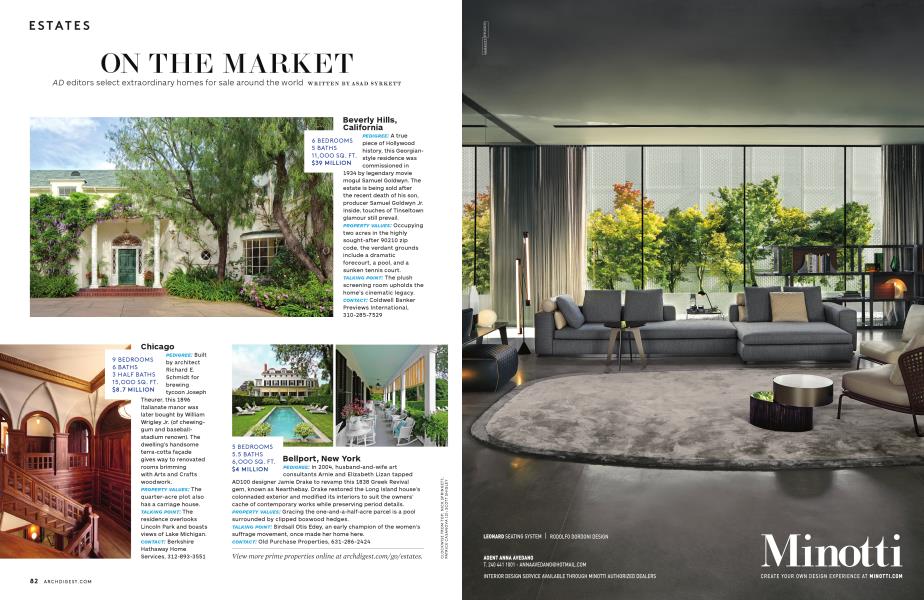
The height and width of the screenshot is (600, 924). What are the coordinates of `chairs` in the screenshot? It's located at (890, 351), (892, 382), (484, 348).